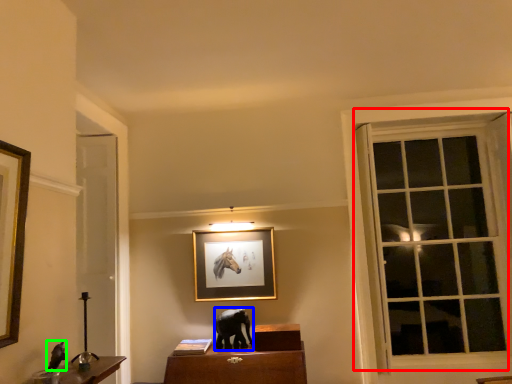
Question: Based on their relative distances, which object is nearer to window (highlighted by a red box)? Choose from animal (highlighted by a blue box) and animal (highlighted by a green box).

Choices:
 (A) animal
 (B) animal

Answer: (A)